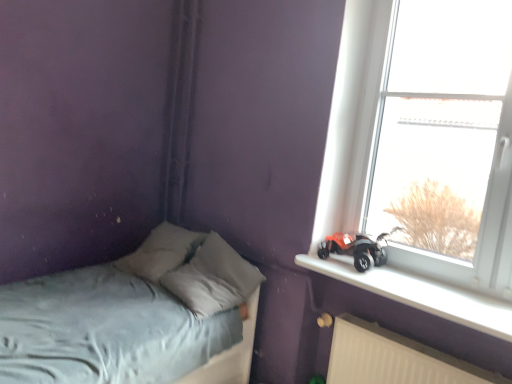
Question: Is orange matte toy car at window sill to the right of white plastic radiator at lower right from the viewer's perspective?

Choices:
 (A) yes
 (B) no

Answer: (B)

Question: From a real-world perspective, does orange matte toy car at window sill sit lower than white plastic radiator at lower right?

Choices:
 (A) yes
 (B) no

Answer: (B)

Question: Can you confirm if orange matte toy car at window sill is smaller than white plastic radiator at lower right?

Choices:
 (A) yes
 (B) no

Answer: (A)

Question: Does orange matte toy car at window sill touch white plastic radiator at lower right?

Choices:
 (A) no
 (B) yes

Answer: (A)

Question: Is orange matte toy car at window sill located outside white plastic radiator at lower right?

Choices:
 (A) yes
 (B) no

Answer: (A)

Question: Is orange matte toy car at window sill in front of or behind white plastic window sill at upper right in the image?

Choices:
 (A) front
 (B) behind

Answer: (B)

Question: From the image's perspective, is orange matte toy car at window sill above or below white plastic window sill at upper right?

Choices:
 (A) below
 (B) above

Answer: (B)

Question: Is point (331, 246) closer or farther from the camera than point (391, 266)?

Choices:
 (A) farther
 (B) closer

Answer: (A)

Question: From a real-world perspective, is orange matte toy car at window sill above or below white plastic window sill at upper right?

Choices:
 (A) below
 (B) above

Answer: (B)

Question: Is transparent glass window at upper right taller or shorter than white plastic window sill at upper right?

Choices:
 (A) tall
 (B) short

Answer: (A)

Question: From a real-world perspective, relative to white plastic window sill at upper right, is transparent glass window at upper right vertically above or below?

Choices:
 (A) above
 (B) below

Answer: (A)

Question: Is transparent glass window at upper right wider or thinner than white plastic window sill at upper right?

Choices:
 (A) wide
 (B) thin

Answer: (B)

Question: Does point (368, 105) appear closer or farther from the camera than point (483, 309)?

Choices:
 (A) closer
 (B) farther

Answer: (B)

Question: Is point pyautogui.click(x=410, y=286) positioned closer to the camera than point pyautogui.click(x=327, y=236)?

Choices:
 (A) closer
 (B) farther

Answer: (A)

Question: Relative to orange matte toy car at window sill, is white plastic window sill at upper right in front or behind?

Choices:
 (A) front
 (B) behind

Answer: (A)